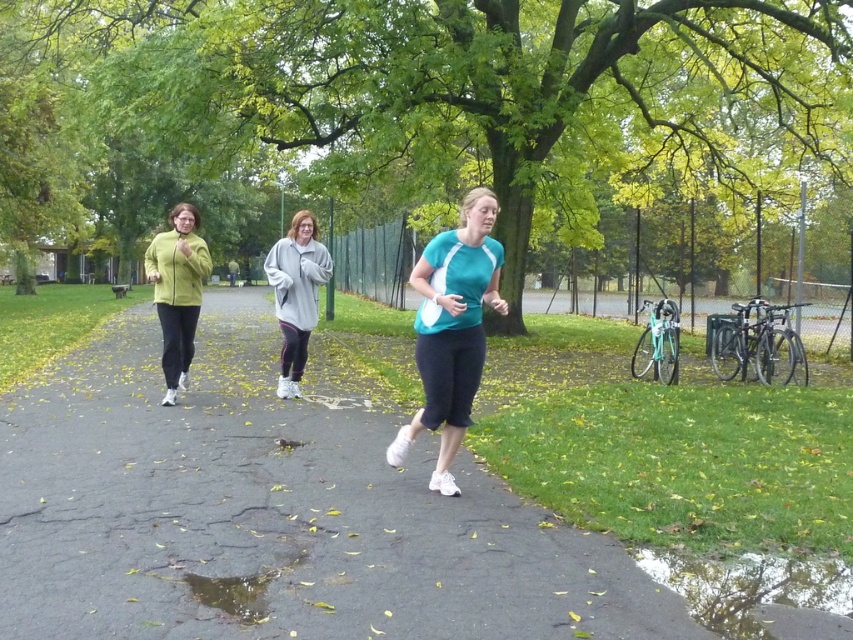
You are standing at point (283, 292) and want to reach point (641, 561). Which direction should you move to get there?

You should move forward because point (641, 561) is in front of point (283, 292).

You are standing at the starting point of the jogging path in the park. You see two points marked on the path ahead of you at coordinates point (450, 321) and point (286, 333). Which point is closer to you?

Point (450, 321) is closer to the viewer than point (286, 333), so the point at (450, 321) is closer to you.

You are a photographer trying to capture a group of people exercising in the park. You notice two individuals wearing a teal matte shirt at center and a gray fleece sweatshirt at center. Which one would be a better subject if you want to focus on someone taller?

The teal matte shirt at center is taller than the gray fleece sweatshirt at center, so it would be a better subject if focusing on someone taller.